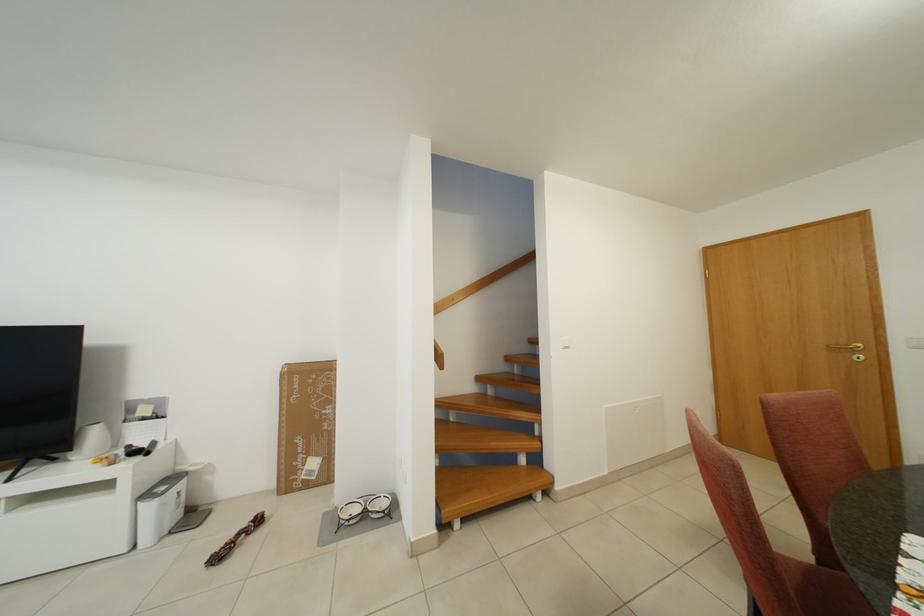
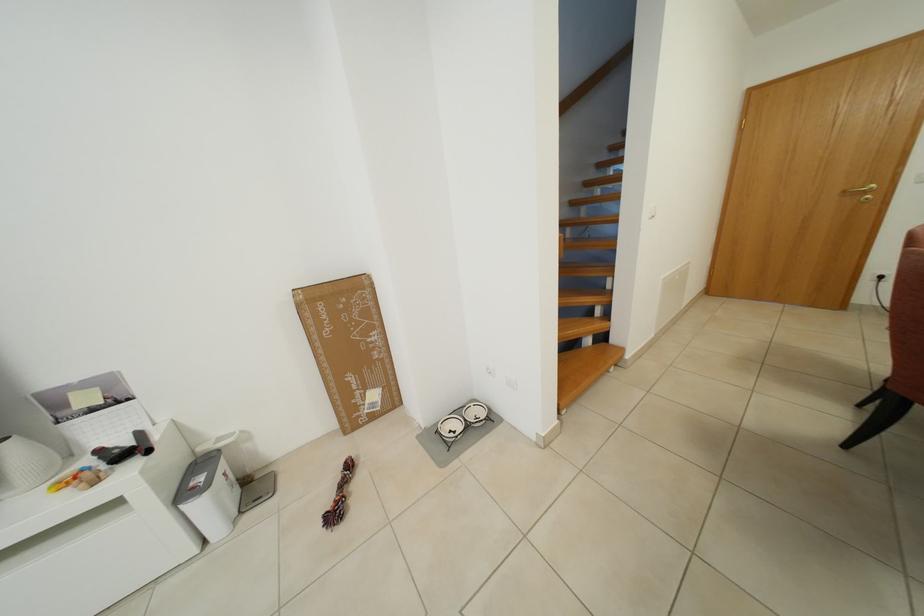
The point at (x=322, y=468) is marked in the first image. Where is the corresponding point in the second image?

(382, 400)